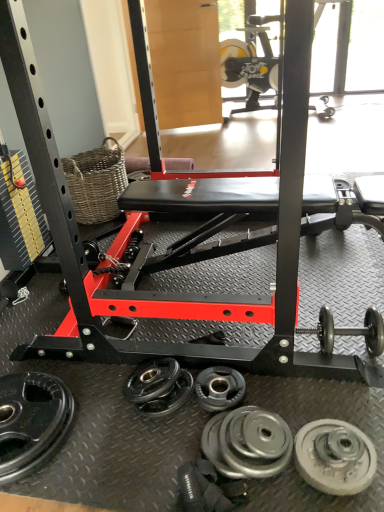
At what (x,y) coordinates should I click in order to perform the action: click on free space underneath black rubber weight plate at lower left, the 4th wheel from the right (from a real-world perspective). Please return your answer as a coordinate pair (x, y). This screenshot has width=384, height=512. Looking at the image, I should click on pyautogui.click(x=23, y=426).